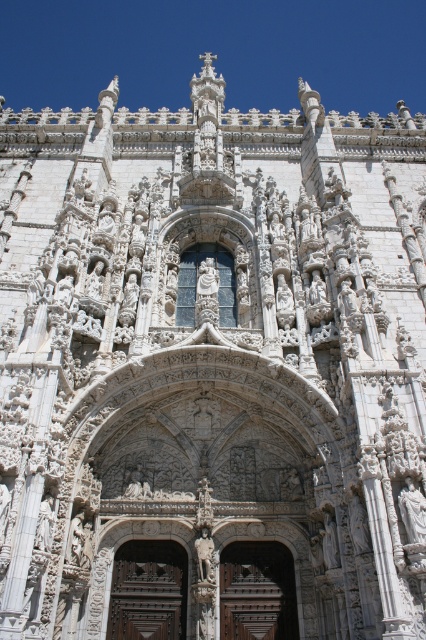
How much distance is there between brown carved wood door at center and brown wooden door at center?

brown carved wood door at center is 24.61 feet away from brown wooden door at center.

Can you confirm if brown carved wood door at center is shorter than brown wooden door at center?

Incorrect, brown carved wood door at center's height does not fall short of brown wooden door at center's.

Is point (120, 596) farther from camera compared to point (279, 634)?

That is True.

Find the location of `brown carved wood door at center`. brown carved wood door at center is located at coordinates (147, 592).